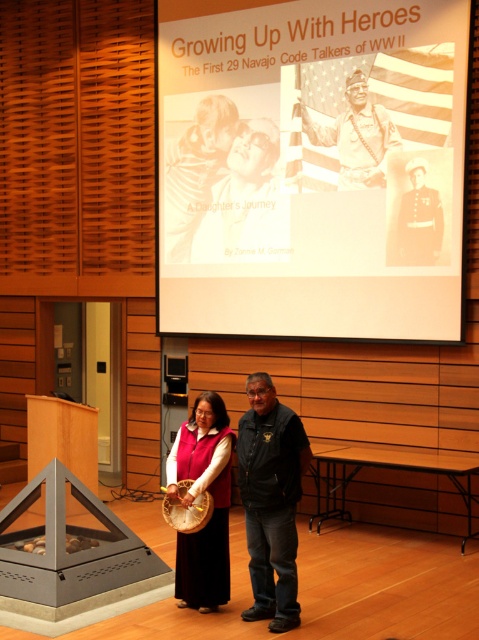
You are organizing a cultural event and need to place a black leather jacket at center and a wooden banjo at center on a table. The table is 24 inches wide. Will both items fit side by side on the table?

The black leather jacket at center is 24.25 inches from the wooden banjo at center, meaning the total space they occupy is 24.25 inches. Since the table is only 24 inches wide, the items will not fit side by side as they require slightly more space than available.

You are an attendee at the presentation and need to locate the white paper at upper center mentioned in the slide. Based on the coordinates provided in the description, can you determine its position relative to the screen?

The white paper at upper center is located at coordinates point (311, 168), which places it slightly to the left and above the center of the screen.